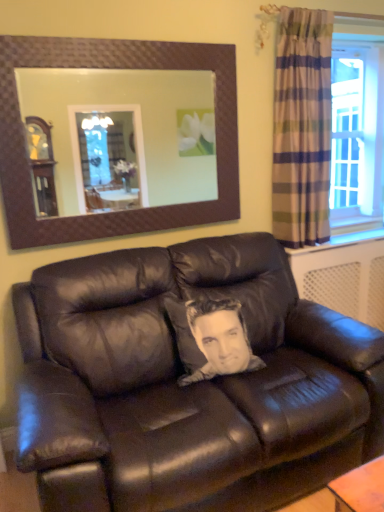
This screenshot has width=384, height=512. What are the coordinates of `vacant region under brown textured mirror at upper center (from a real-world perspective)` in the screenshot? It's located at (129, 245).